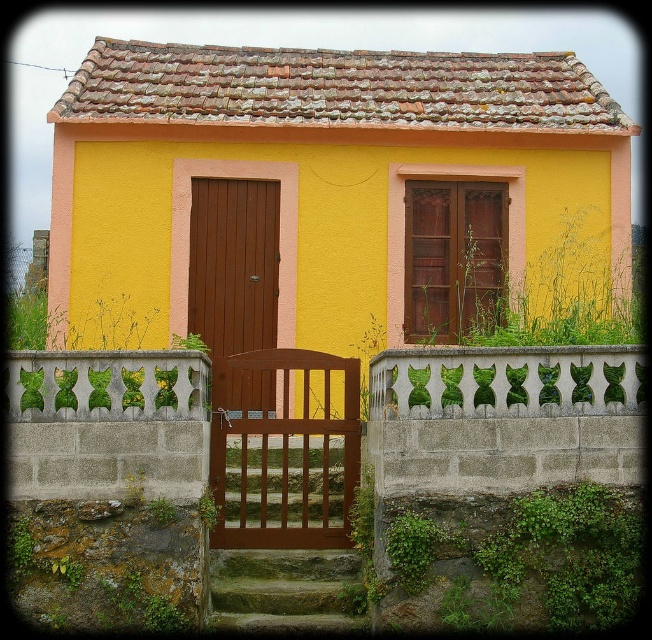
Does point (297, 369) come in front of point (246, 184)?

That is True.

Looking at this image, can you confirm if brown wooden gate at center is smaller than brown wooden door at center?

No.

Does point (310, 432) come behind point (241, 184)?

No, it is not.

The image size is (652, 640). Find the location of `brown wooden gate at center`. brown wooden gate at center is located at coordinates (284, 449).